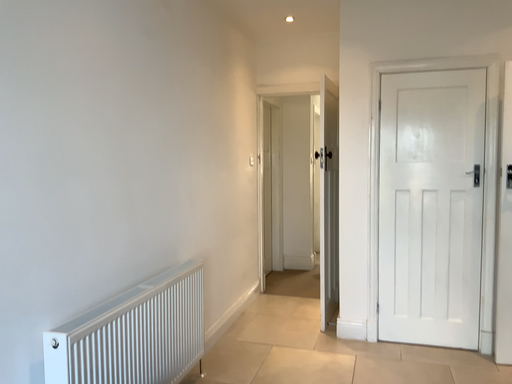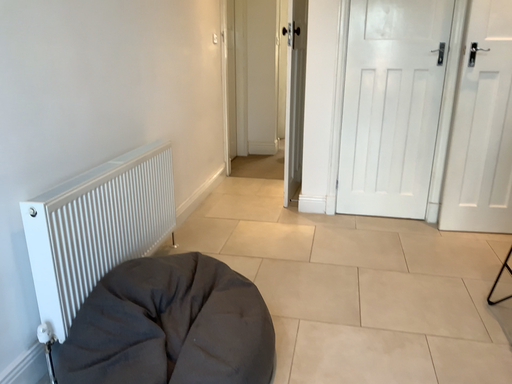
Question: Which way did the camera rotate in the video?

Choices:
 (A) rotated downward
 (B) rotated upward

Answer: (A)